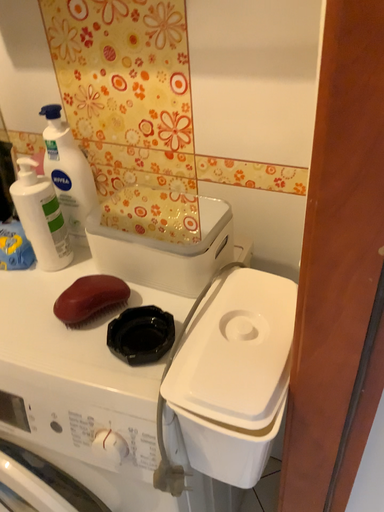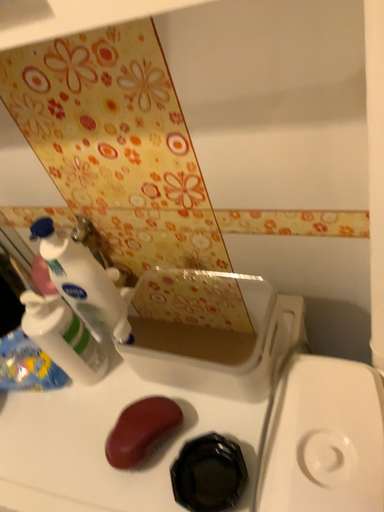
Question: Which way did the camera rotate in the video?

Choices:
 (A) rotated downward
 (B) rotated upward

Answer: (A)